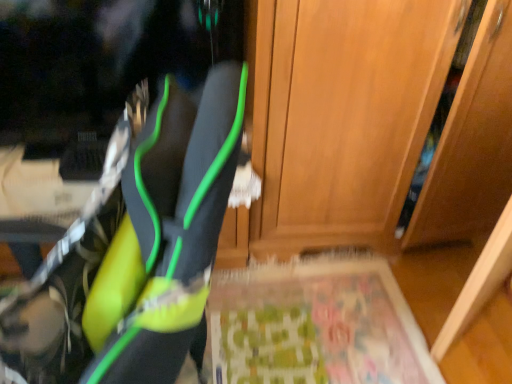
Question: Should I look upward or downward to see wooden door at center?

Choices:
 (A) down
 (B) up

Answer: (B)

Question: Should I look upward or downward to see neon yellow fabric shoe at left?

Choices:
 (A) up
 (B) down

Answer: (B)

Question: Would you say neon yellow fabric shoe at left contains green fabric yoga mat at lower center?

Choices:
 (A) no
 (B) yes

Answer: (A)

Question: Is neon yellow fabric shoe at left in front of green fabric yoga mat at lower center?

Choices:
 (A) yes
 (B) no

Answer: (A)

Question: Considering the relative sizes of neon yellow fabric shoe at left and green fabric yoga mat at lower center in the image provided, is neon yellow fabric shoe at left shorter than green fabric yoga mat at lower center?

Choices:
 (A) no
 (B) yes

Answer: (A)

Question: Is neon yellow fabric shoe at left taller than green fabric yoga mat at lower center?

Choices:
 (A) yes
 (B) no

Answer: (A)

Question: Considering the relative sizes of neon yellow fabric shoe at left and green fabric yoga mat at lower center in the image provided, is neon yellow fabric shoe at left thinner than green fabric yoga mat at lower center?

Choices:
 (A) no
 (B) yes

Answer: (B)

Question: From a real-world perspective, is neon yellow fabric shoe at left on top of green fabric yoga mat at lower center?

Choices:
 (A) no
 (B) yes

Answer: (B)

Question: From a real-world perspective, is green fabric yoga mat at lower center positioned over wooden door at center based on gravity?

Choices:
 (A) no
 (B) yes

Answer: (A)

Question: Is green fabric yoga mat at lower center bigger than wooden door at center?

Choices:
 (A) no
 (B) yes

Answer: (A)

Question: Is green fabric yoga mat at lower center directly adjacent to wooden door at center?

Choices:
 (A) no
 (B) yes

Answer: (A)

Question: Considering the relative sizes of green fabric yoga mat at lower center and wooden door at center in the image provided, is green fabric yoga mat at lower center taller than wooden door at center?

Choices:
 (A) no
 (B) yes

Answer: (A)

Question: Can you confirm if green fabric yoga mat at lower center is positioned to the right of wooden door at center?

Choices:
 (A) no
 (B) yes

Answer: (A)

Question: Considering the relative sizes of green fabric yoga mat at lower center and wooden door at center in the image provided, is green fabric yoga mat at lower center shorter than wooden door at center?

Choices:
 (A) yes
 (B) no

Answer: (A)

Question: Is wooden door at center aimed at green fabric yoga mat at lower center?

Choices:
 (A) yes
 (B) no

Answer: (A)